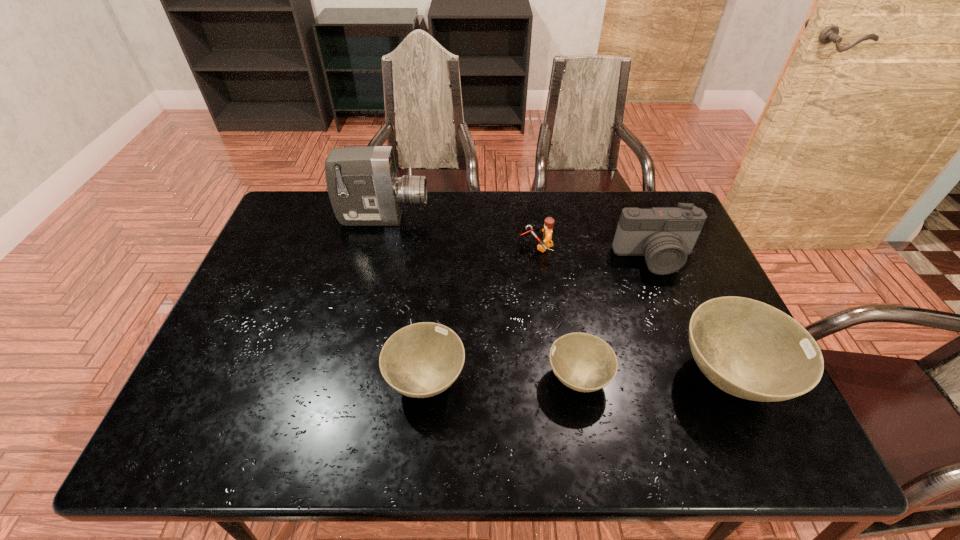
You are a GUI agent. You are given a task and a screenshot of the screen. Output one action in this format:
    pyautogui.click(x=<x>, y=<y>)
    Task: Click on the vacant space in between the second tallest bowl and the Lego
    The width and height of the screenshot is (960, 540).
    Given the screenshot: What is the action you would take?
    [x=481, y=313]

Where is `free space between the Lego and the camera`? The height and width of the screenshot is (540, 960). free space between the Lego and the camera is located at coordinates (595, 252).

The width and height of the screenshot is (960, 540). I want to click on free area in between the second shortest bowl and the Lego, so click(x=481, y=313).

The image size is (960, 540). In order to click on free space between the tallest object and the tallest bowl in this screenshot , I will do `click(557, 298)`.

The width and height of the screenshot is (960, 540). I want to click on vacant point located between the camera and the shortest object, so click(616, 318).

The image size is (960, 540). Find the location of `the second closest object relative to the camcorder`. the second closest object relative to the camcorder is located at coordinates (421, 360).

The width and height of the screenshot is (960, 540). I want to click on object that ranks as the third closest to the tallest bowl, so click(x=547, y=242).

You are a GUI agent. You are given a task and a screenshot of the screen. Output one action in this format:
    pyautogui.click(x=<x>, y=<y>)
    Task: Click on the bowl that stands as the closest to the tallest object
    
    Given the screenshot: What is the action you would take?
    pyautogui.click(x=421, y=360)

Where is `bowl that stands as the closest to the shortest object`? bowl that stands as the closest to the shortest object is located at coordinates (749, 349).

Identify the location of free region that satisfies the following two spatial constraints: 1. on the back side of the fifth tallest object; 2. at the front of the farthest object, highlighting the lens. This screenshot has height=540, width=960. (442, 218).